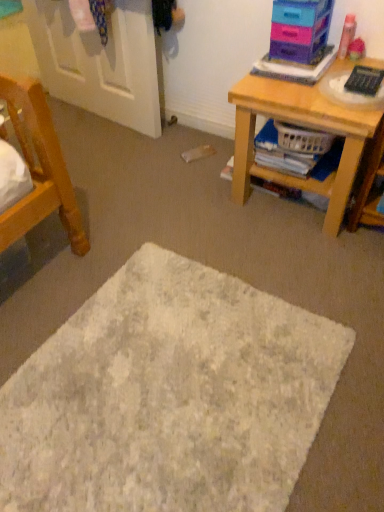
In order to click on plastic storage drawers at upper right in this screenshot , I will do `click(299, 29)`.

You are a GUI agent. You are given a task and a screenshot of the screen. Output one action in this format:
    pyautogui.click(x=<x>, y=<y>)
    Task: Click on the plastic basket at lower right
    This screenshot has width=384, height=512.
    Given the screenshot: What is the action you would take?
    pyautogui.click(x=294, y=156)

Between white painted wood door at upper left and black plastic remote control at upper right, which one has larger width?

Wider between the two is black plastic remote control at upper right.

Identify the location of remote control in front of the white painted wood door at upper left. Image resolution: width=384 pixels, height=512 pixels. pos(364,81).

Visually, is white painted wood door at upper left positioned to the left or to the right of black plastic remote control at upper right?

Based on their positions, white painted wood door at upper left is located to the left of black plastic remote control at upper right.

Who is shorter, white painted wood door at upper left or black plastic remote control at upper right?

With less height is black plastic remote control at upper right.

In the scene shown: Is wooden desk at right a part of white textured mat at center?

No, white textured mat at center does not contain wooden desk at right.

Where is `desk on the right of white textured mat at center`? This screenshot has width=384, height=512. desk on the right of white textured mat at center is located at coordinates (310, 127).

How far apart are white textured mat at center and wooden desk at right?

The distance of white textured mat at center from wooden desk at right is 29.66 inches.

Does white textured mat at center have a greater width compared to wooden desk at right?

Correct, the width of white textured mat at center exceeds that of wooden desk at right.

Does point (358, 76) come in front of point (329, 222)?

Yes.

From the image's perspective, which one is positioned higher, black plastic remote control at upper right or wooden desk at right?

From the image's view, black plastic remote control at upper right is above.

Which object is positioned more to the left, black plastic remote control at upper right or wooden desk at right?

wooden desk at right.

I want to click on remote control behind the wooden desk at right, so click(x=364, y=81).

From the image's perspective, which one is positioned lower, white textured mat at center or white painted wood door at upper left?

white textured mat at center appears lower in the image.

Considering the sizes of white textured mat at center and white painted wood door at upper left in the image, is white textured mat at center taller or shorter than white painted wood door at upper left?

Clearly, white textured mat at center is shorter compared to white painted wood door at upper left.

Is white textured mat at center facing away from white painted wood door at upper left?

No, white textured mat at center's orientation is not away from white painted wood door at upper left.

The height and width of the screenshot is (512, 384). I want to click on mat beneath the white painted wood door at upper left (from a real-world perspective), so pyautogui.click(x=169, y=396).

Considering the sizes of objects plastic basket at lower right and wooden desk at right in the image provided, who is wider, plastic basket at lower right or wooden desk at right?

Wider between the two is wooden desk at right.

Based on the photo, is plastic basket at lower right not close to wooden desk at right?

No, plastic basket at lower right is not far away from wooden desk at right.

Do you think plastic basket at lower right is within wooden desk at right, or outside of it?

plastic basket at lower right can be found inside wooden desk at right.

Considering their positions, is plastic basket at lower right located in front of or behind wooden desk at right?

In the image, plastic basket at lower right appears behind wooden desk at right.

From the picture: How many degrees apart are the facing directions of black plastic remote control at upper right and plastic storage drawers at upper right?

The angle between the facing direction of black plastic remote control at upper right and the facing direction of plastic storage drawers at upper right is 2.25 degrees.

Considering the sizes of objects black plastic remote control at upper right and plastic storage drawers at upper right in the image provided, who is bigger, black plastic remote control at upper right or plastic storage drawers at upper right?

With larger size is plastic storage drawers at upper right.

Considering the positions of points (356, 89) and (303, 38), is point (356, 89) closer to camera compared to point (303, 38)?

Yes, it is in front of point (303, 38).

Is black plastic remote control at upper right positioned before plastic storage drawers at upper right?

Yes, black plastic remote control at upper right is closer to the camera.

Which is more to the left, wooden desk at right or black plastic remote control at upper right?

Positioned to the left is wooden desk at right.

Can you confirm if wooden desk at right is smaller than black plastic remote control at upper right?

Incorrect, wooden desk at right is not smaller in size than black plastic remote control at upper right.

I want to click on remote control located in front of the white painted wood door at upper left, so (364, 81).

What are the coordinates of `desk above the white textured mat at center (from a real-world perspective)` in the screenshot? It's located at (310, 127).

Considering their positions, is black plastic remote control at upper right positioned closer to white painted wood door at upper left than wooden desk at right?

wooden desk at right is positioned closer to the anchor white painted wood door at upper left.

Which object lies further to the anchor point wooden desk at right, white textured mat at center or plastic storage drawers at upper right?

white textured mat at center is positioned further to the anchor wooden desk at right.

When comparing their distances from black plastic remote control at upper right, does plastic storage drawers at upper right or plastic basket at lower right seem further?

plastic basket at lower right is positioned further to the anchor black plastic remote control at upper right.

From the image, which object appears to be farther from plastic storage drawers at upper right, white painted wood door at upper left or wooden desk at right?

white painted wood door at upper left lies further to plastic storage drawers at upper right than the other object.

From the image, which object appears to be nearer to white painted wood door at upper left, wooden desk at right or black plastic remote control at upper right?

wooden desk at right.

From the image, which object appears to be nearer to black plastic remote control at upper right, white textured mat at center or plastic storage drawers at upper right?

Among the two, plastic storage drawers at upper right is located nearer to black plastic remote control at upper right.

Which object lies further to the anchor point white textured mat at center, wooden desk at right or black plastic remote control at upper right?

Among the two, black plastic remote control at upper right is located further to white textured mat at center.

From the image, which object appears to be farther from white painted wood door at upper left, black plastic remote control at upper right or plastic storage drawers at upper right?

The object further to white painted wood door at upper left is black plastic remote control at upper right.

Where is `desk between white painted wood door at upper left and white textured mat at center from top to bottom`? The width and height of the screenshot is (384, 512). desk between white painted wood door at upper left and white textured mat at center from top to bottom is located at coordinates (310, 127).

Locate an element on the screen. The width and height of the screenshot is (384, 512). desk that lies between plastic storage drawers at upper right and white textured mat at center from top to bottom is located at coordinates (310, 127).

Locate an element on the screen. This screenshot has height=512, width=384. remote control between plastic storage drawers at upper right and plastic basket at lower right from top to bottom is located at coordinates (364, 81).

This screenshot has width=384, height=512. I want to click on shelf between white painted wood door at upper left and white textured mat at center vertically, so click(x=299, y=29).